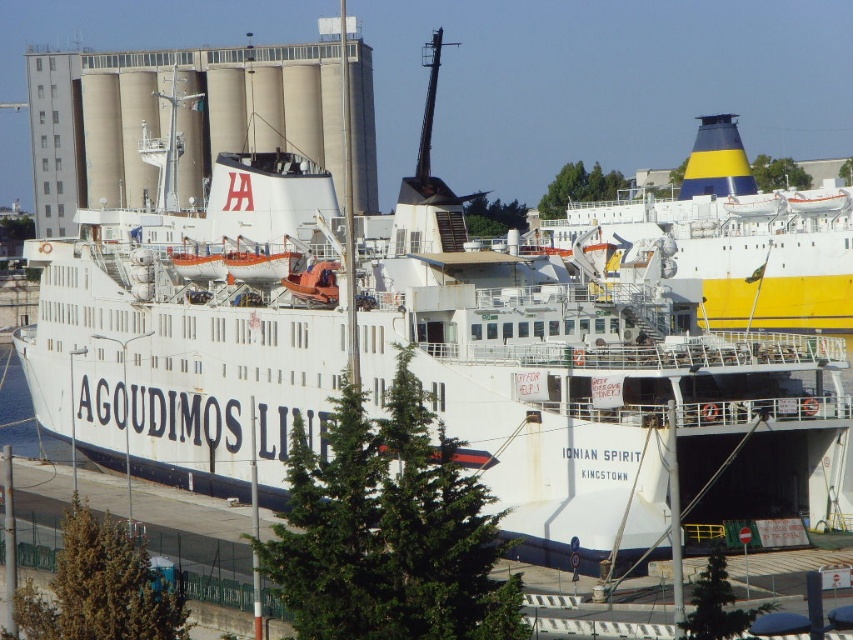
Question: Is yellow and blue painted ship at upper right positioned before blue water at lower left?

Choices:
 (A) yes
 (B) no

Answer: (A)

Question: In this image, where is yellow and blue painted ship at upper right located relative to blue water at lower left?

Choices:
 (A) above
 (B) below

Answer: (A)

Question: Which point is farther to the camera?

Choices:
 (A) blue water at lower left
 (B) yellow and blue painted ship at upper right

Answer: (A)

Question: Observing the image, what is the correct spatial positioning of yellow and blue painted ship at upper right in reference to blue water at lower left?

Choices:
 (A) right
 (B) left

Answer: (A)

Question: Which object appears farthest from the camera in this image?

Choices:
 (A) blue water at lower left
 (B) yellow and blue painted ship at upper right

Answer: (A)

Question: Which object is closer to the camera taking this photo?

Choices:
 (A) yellow and blue painted ship at upper right
 (B) blue water at lower left

Answer: (A)